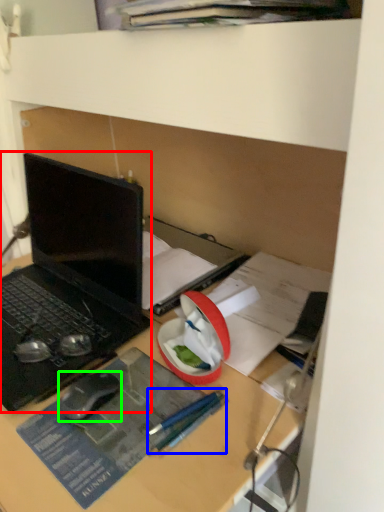
Question: Considering the real-world distances, which object is closest to laptop (highlighted by a red box)? pencil (highlighted by a blue box) or mouse (highlighted by a green box).

Choices:
 (A) pencil
 (B) mouse

Answer: (B)